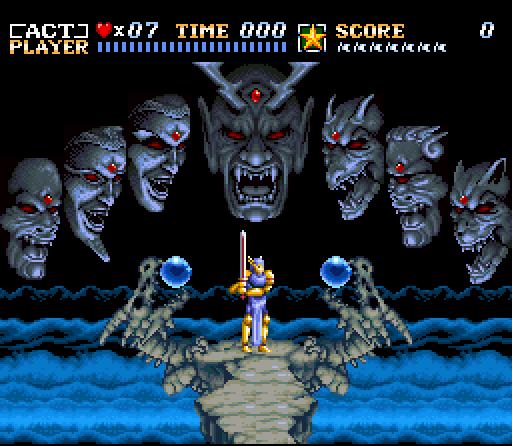
I want to click on game computer, so 454,90.